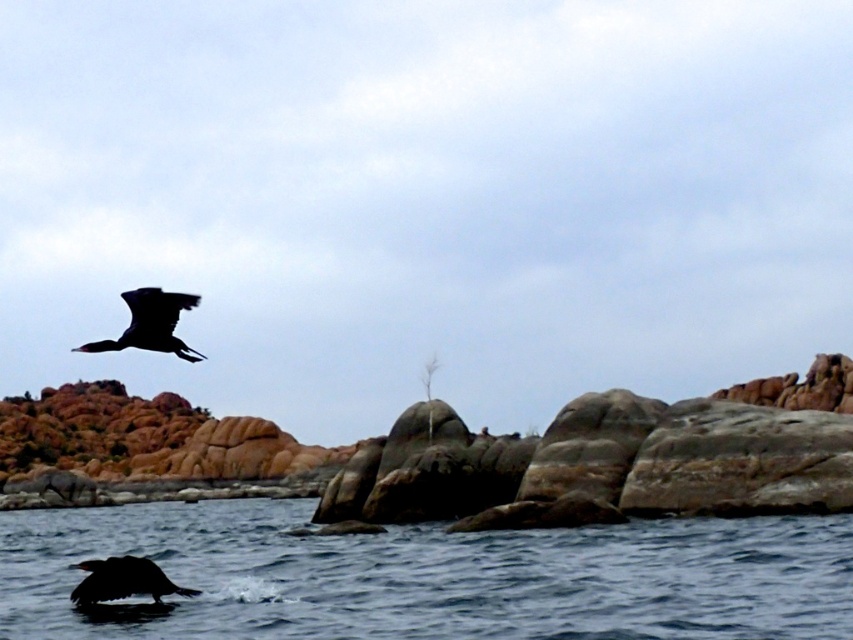
Question: Which point is closer to the camera taking this photo?

Choices:
 (A) (136, 328)
 (B) (140, 579)
 (C) (231, 612)

Answer: (A)

Question: Does smooth dark blue water at lower center have a greater width compared to shiny black bird at upper left?

Choices:
 (A) yes
 (B) no

Answer: (A)

Question: Does smooth dark blue water at lower center come in front of shiny black bird at upper left?

Choices:
 (A) yes
 (B) no

Answer: (A)

Question: Among these points, which one is nearest to the camera?

Choices:
 (A) (160, 577)
 (B) (90, 344)
 (C) (537, 557)

Answer: (B)

Question: Is shiny black bird at upper left to the left of silhouette glossy bird at lower left from the viewer's perspective?

Choices:
 (A) no
 (B) yes

Answer: (B)

Question: Which point is closer to the camera?

Choices:
 (A) (155, 588)
 (B) (795, 579)
 (C) (173, 307)

Answer: (C)